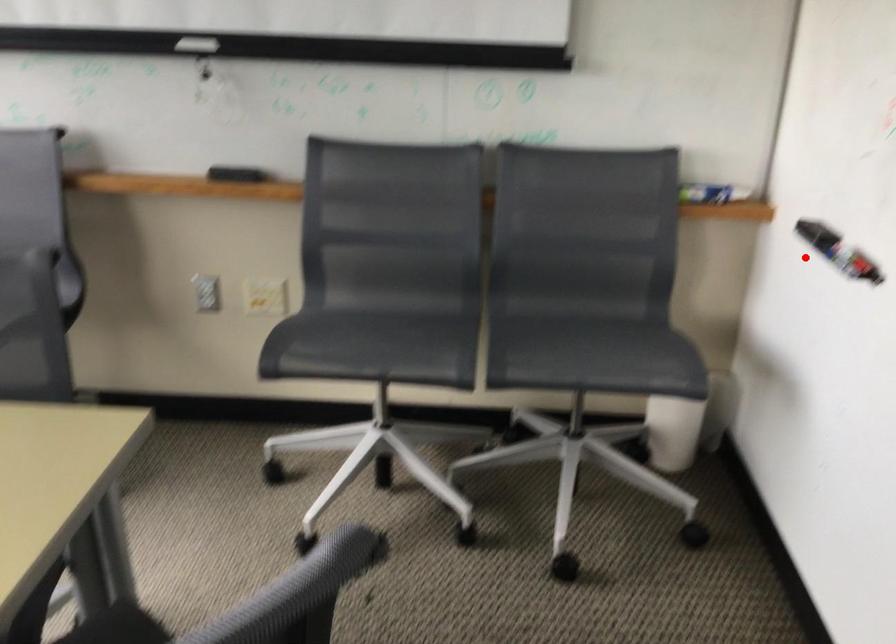
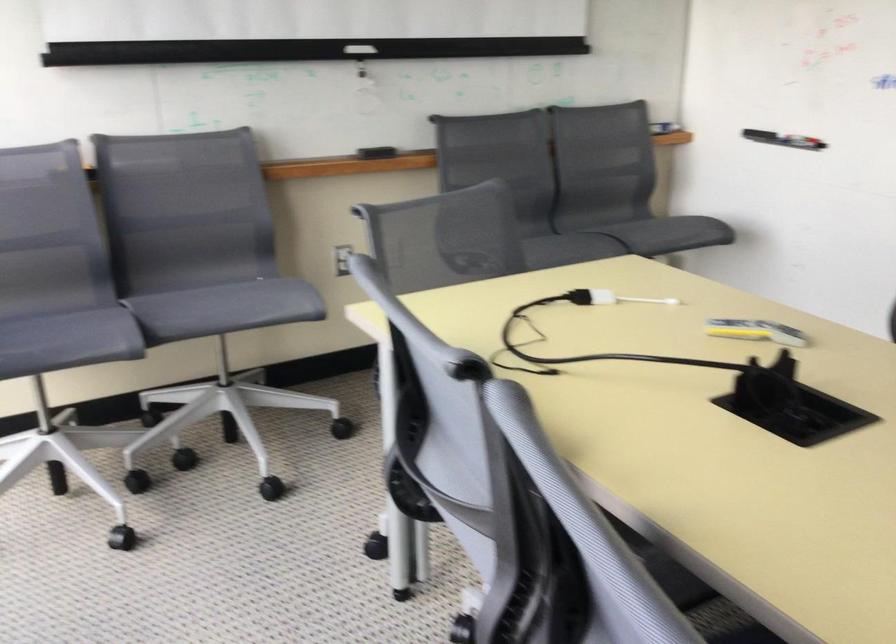
Question: I am providing you with two images of the same scene from different viewpoints. A red point is shown in image1. For the corresponding object point in image2, is it positioned nearer or farther from the camera?

Choices:
 (A) Nearer
 (B) Farther

Answer: (B)